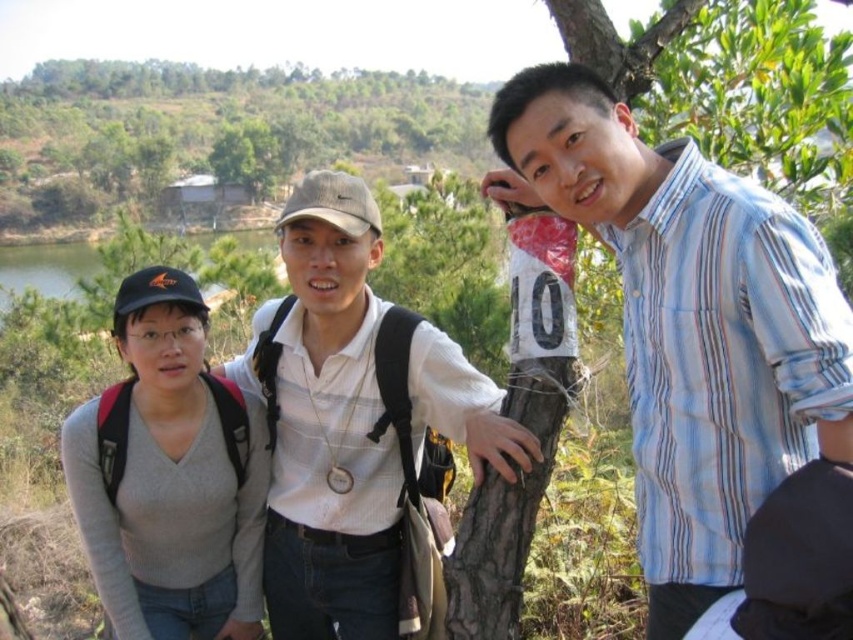
You are a photographer trying to capture a group photo of the blue striped shirt at right and the gray matte sweater at left. If you want to ensure both are in focus, which subject should you focus on first considering their heights?

The blue striped shirt at right has a greater height compared to gray matte sweater at left. To ensure both are in focus, you should focus on the taller subject first, which is the blue striped shirt at right, as focusing on the closer subject can sometimes blur the background. However, since they are both at similar distances but different heights, using a smaller aperture or focusing on the midpoint between them might be more effective. But based on their height difference alone, focusing on the taller, i

You are standing at the origin point in the image. Which direction should you move to reach the gray sweater at left?

You should move towards the left direction to reach the gray sweater at left since it is located at point 0.662 on the x and 0.385 on the y coordinate.